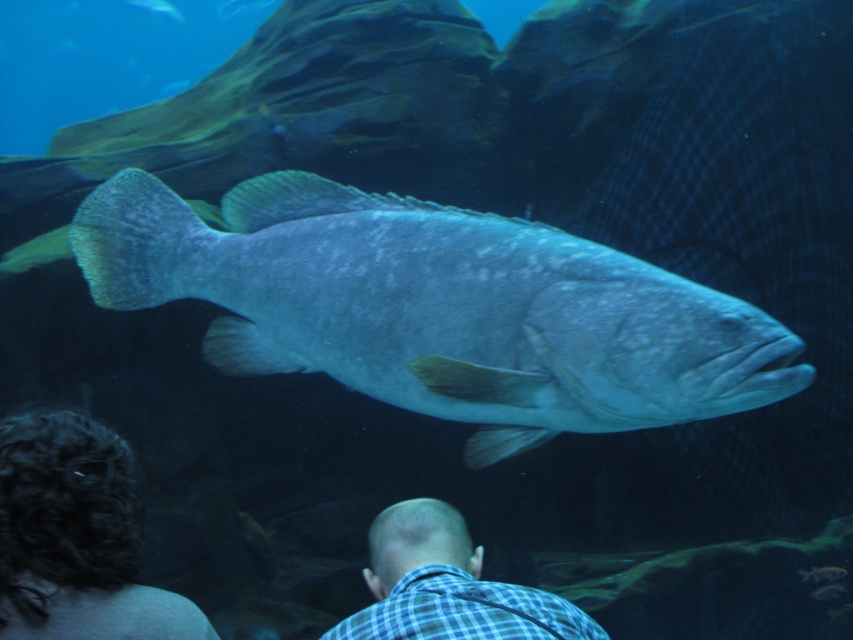
Is shiny blue fish at center wider than dark curly hair at lower left?

Yes.

Locate an element on the screen. shiny blue fish at center is located at coordinates (436, 308).

The height and width of the screenshot is (640, 853). Describe the element at coordinates (436, 308) in the screenshot. I see `shiny blue fish at center` at that location.

Where is `shiny blue fish at center`? The height and width of the screenshot is (640, 853). shiny blue fish at center is located at coordinates (436, 308).

Between shiny blue fish at center and blue checkered shirt at lower center, which one is positioned lower?

blue checkered shirt at lower center is below.

The height and width of the screenshot is (640, 853). Describe the element at coordinates (436, 308) in the screenshot. I see `shiny blue fish at center` at that location.

Locate an element on the screen. Image resolution: width=853 pixels, height=640 pixels. shiny blue fish at center is located at coordinates (436, 308).

How much distance is there between dark curly hair at lower left and blue checkered shirt at lower center?

dark curly hair at lower left and blue checkered shirt at lower center are 26.40 inches apart.

Is dark curly hair at lower left to the left of blue checkered shirt at lower center from the viewer's perspective?

Correct, you'll find dark curly hair at lower left to the left of blue checkered shirt at lower center.

Between point (122, 452) and point (393, 534), which one is positioned behind?

Positioned behind is point (393, 534).

The image size is (853, 640). Identify the location of dark curly hair at lower left. click(x=76, y=538).